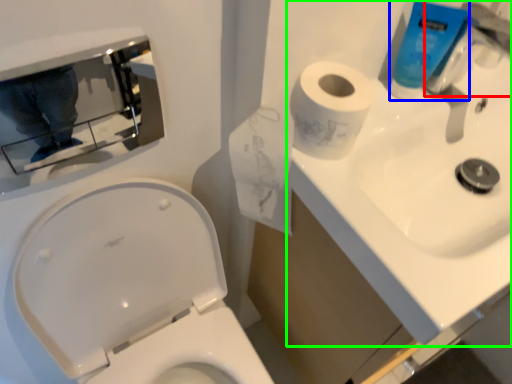
Question: Estimate the real-world distances between objects in this image. Which object is closer to faucet (highlighted by a red box), cleaning product (highlighted by a blue box) or sink (highlighted by a green box)?

Choices:
 (A) cleaning product
 (B) sink

Answer: (A)